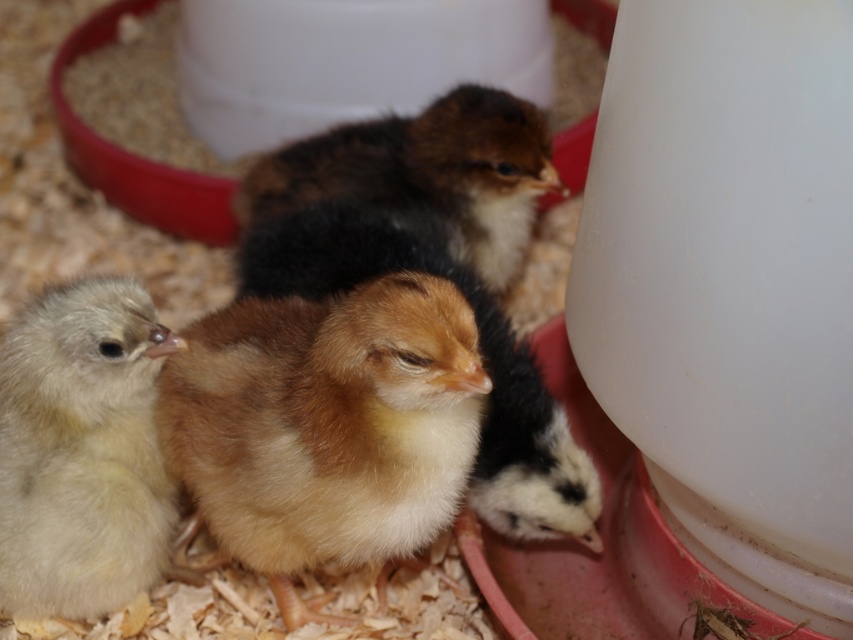
Question: Which point is closer to the camera?

Choices:
 (A) brown fluffy chick at center
 (B) fluffy yellow chick at center
 (C) light yellow fluffy chick at lower left
 (D) golden fluffy chick at center

Answer: (B)

Question: Can you confirm if fluffy yellow chick at center is positioned to the left of light yellow fluffy chick at lower left?

Choices:
 (A) no
 (B) yes

Answer: (A)

Question: Is the position of light yellow fluffy chick at lower left more distant than that of golden fluffy chick at center?

Choices:
 (A) yes
 (B) no

Answer: (B)

Question: Which of the following is the closest to the observer?

Choices:
 (A) light yellow fluffy chick at lower left
 (B) golden fluffy chick at center
 (C) fluffy yellow chick at center
 (D) brown fluffy chick at center

Answer: (C)

Question: Which point is farther to the camera?

Choices:
 (A) (422, 112)
 (B) (294, 557)
 (C) (409, 241)
 (D) (42, 529)

Answer: (A)

Question: In this image, where is light yellow fluffy chick at lower left located relative to golden fluffy chick at center?

Choices:
 (A) below
 (B) above

Answer: (A)